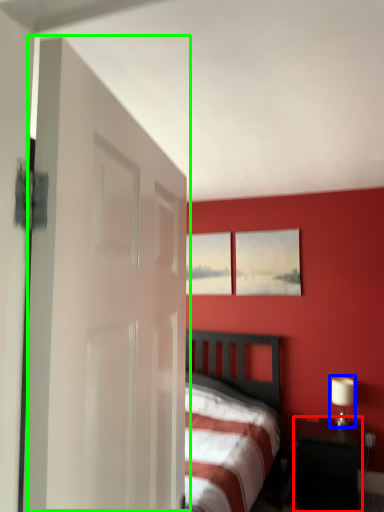
Question: Which is nearer to the nightstand (highlighted by a red box)? table lamp (highlighted by a blue box) or door (highlighted by a green box).

Choices:
 (A) table lamp
 (B) door

Answer: (A)